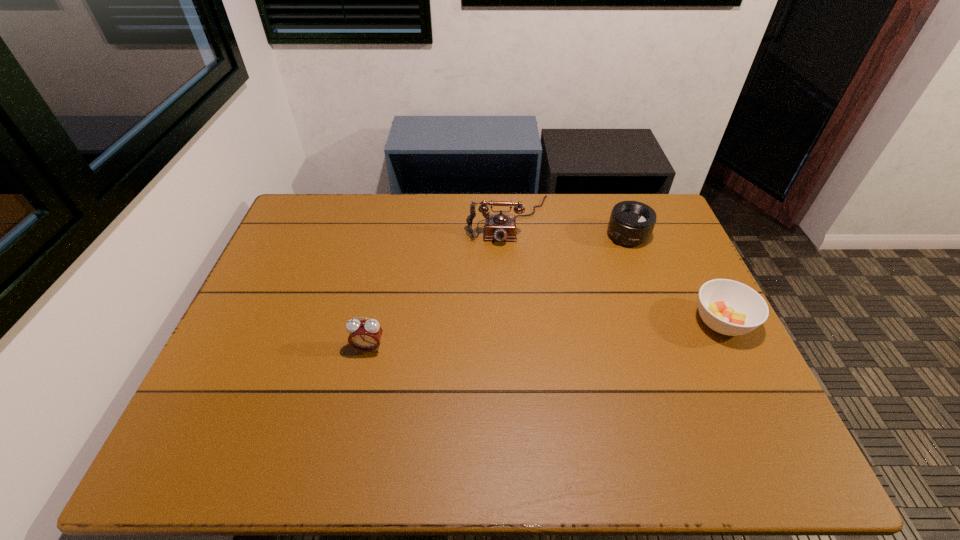
At what (x,y) coordinates should I click in order to perform the action: click on vacant region between the soup bowl and the third object from left to right. Please return your answer as a coordinate pair (x, y). The image size is (960, 540). Looking at the image, I should click on (675, 279).

Image resolution: width=960 pixels, height=540 pixels. I want to click on vacant point located between the telephone and the alarm clock, so click(439, 284).

Identify the location of the second closest object to the leftmost object. (631, 223).

The image size is (960, 540). What are the coordinates of `object that is the third closest one to the second object from left to right` in the screenshot? It's located at (364, 335).

Locate an element on the screen. free space that satisfies the following two spatial constraints: 1. on the front side of the soup bowl; 2. on the left side of the telephone is located at coordinates (516, 322).

Where is `free location that satisfies the following two spatial constraints: 1. on the front side of the soup bowl; 2. on the left side of the third object from right to left`? The width and height of the screenshot is (960, 540). free location that satisfies the following two spatial constraints: 1. on the front side of the soup bowl; 2. on the left side of the third object from right to left is located at coordinates (516, 322).

Locate an element on the screen. This screenshot has height=540, width=960. vacant space that satisfies the following two spatial constraints: 1. on the front side of the third object from left to right; 2. on the right side of the telephone is located at coordinates (510, 235).